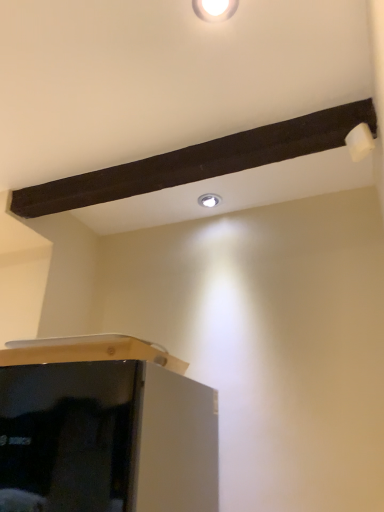
Question: Is white glossy droplight at upper center facing away from white glossy light fixture at upper center?

Choices:
 (A) yes
 (B) no

Answer: (B)

Question: Is white glossy droplight at upper center taller than white glossy light fixture at upper center?

Choices:
 (A) no
 (B) yes

Answer: (A)

Question: Is white glossy droplight at upper center at the left side of white glossy light fixture at upper center?

Choices:
 (A) no
 (B) yes

Answer: (A)

Question: Can you confirm if white glossy droplight at upper center is smaller than white glossy light fixture at upper center?

Choices:
 (A) no
 (B) yes

Answer: (B)

Question: Considering the relative sizes of white glossy droplight at upper center and white glossy light fixture at upper center in the image provided, is white glossy droplight at upper center bigger than white glossy light fixture at upper center?

Choices:
 (A) no
 (B) yes

Answer: (A)

Question: Is the position of white glossy droplight at upper center more distant than that of white glossy light fixture at upper center?

Choices:
 (A) yes
 (B) no

Answer: (A)

Question: Is white glossy light fixture at upper center oriented away from white glossy droplight at upper center?

Choices:
 (A) yes
 (B) no

Answer: (B)

Question: Considering the relative sizes of white glossy light fixture at upper center and white glossy droplight at upper center in the image provided, is white glossy light fixture at upper center shorter than white glossy droplight at upper center?

Choices:
 (A) yes
 (B) no

Answer: (B)

Question: Considering the relative sizes of white glossy light fixture at upper center and white glossy droplight at upper center in the image provided, is white glossy light fixture at upper center bigger than white glossy droplight at upper center?

Choices:
 (A) no
 (B) yes

Answer: (B)

Question: Is white glossy light fixture at upper center outside of white glossy droplight at upper center?

Choices:
 (A) yes
 (B) no

Answer: (A)

Question: Considering the relative positions of white glossy light fixture at upper center and white glossy droplight at upper center in the image provided, is white glossy light fixture at upper center to the left of white glossy droplight at upper center from the viewer's perspective?

Choices:
 (A) no
 (B) yes

Answer: (B)

Question: Can you confirm if white glossy light fixture at upper center is positioned to the right of white glossy droplight at upper center?

Choices:
 (A) yes
 (B) no

Answer: (B)

Question: Considering the relative positions of white glossy droplight at upper center and white glossy light fixture at upper center in the image provided, is white glossy droplight at upper center to the left or to the right of white glossy light fixture at upper center?

Choices:
 (A) left
 (B) right

Answer: (B)